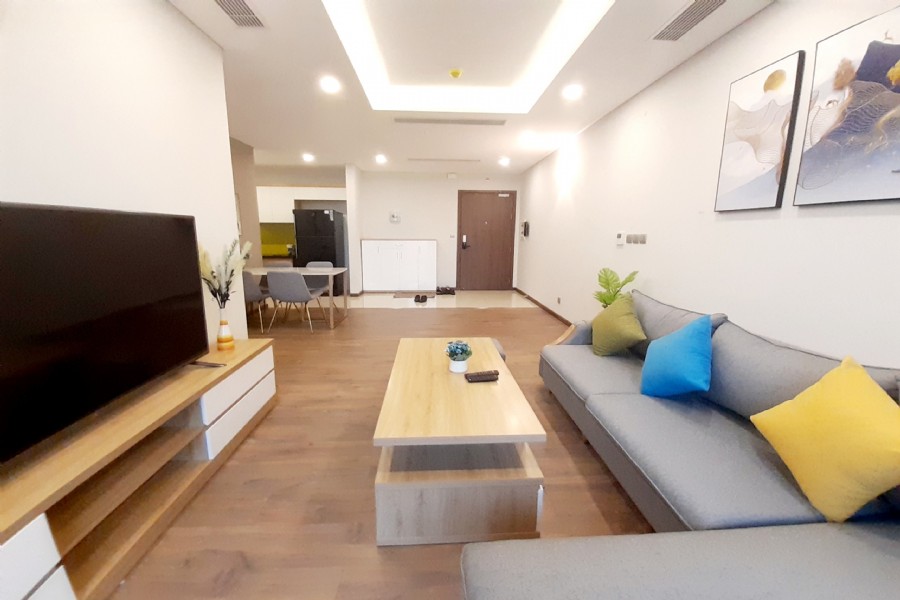
Locate an element on the screen. green pillow is located at coordinates (608, 330).